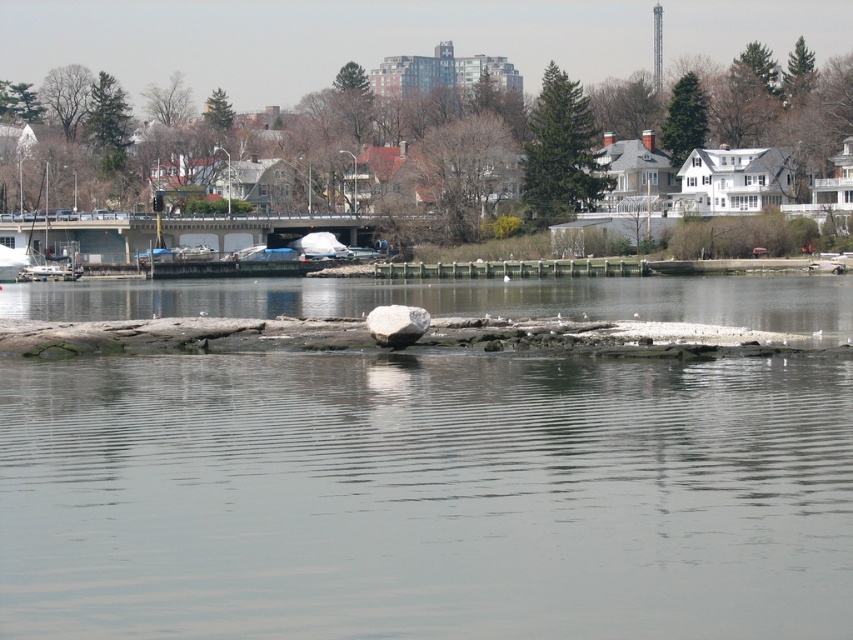
Question: Is clear water at center to the left of gray smooth rock at center from the viewer's perspective?

Choices:
 (A) yes
 (B) no

Answer: (B)

Question: Which of the following is the closest to the observer?

Choices:
 (A) (28, 250)
 (B) (393, 320)

Answer: (B)

Question: Which point appears farthest from the camera in this image?

Choices:
 (A) (44, 204)
 (B) (606, 579)

Answer: (A)

Question: Can you confirm if clear water at center is bigger than gray smooth rock at center?

Choices:
 (A) yes
 (B) no

Answer: (A)

Question: Which of the following is the farthest from the observer?

Choices:
 (A) gray smooth rock at center
 (B) clear water at center
 (C) matte white sailboat at left

Answer: (C)

Question: Is matte white sailboat at left to the right of gray smooth rock at center from the viewer's perspective?

Choices:
 (A) no
 (B) yes

Answer: (A)